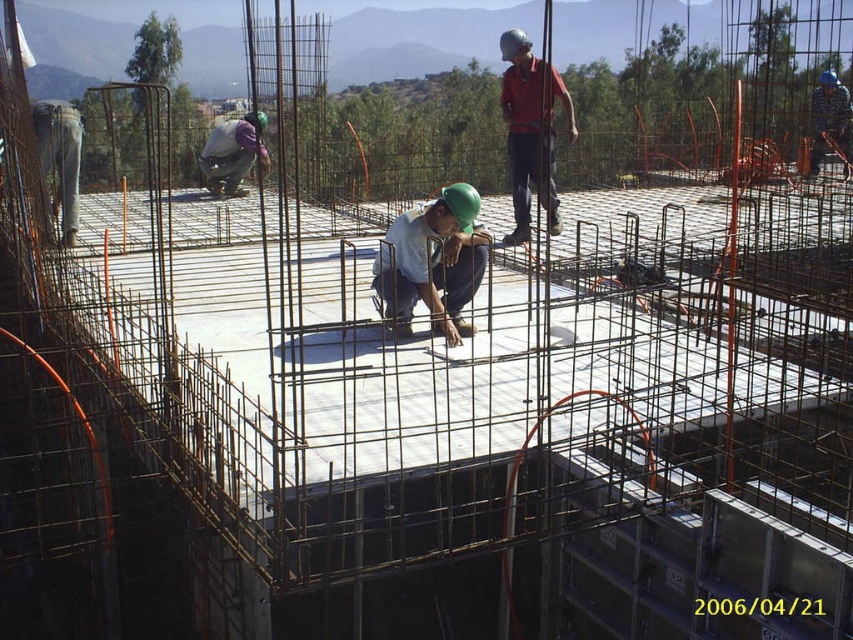
You are a construction supervisor checking the layout of the rebar cages. You notice a point at coordinates [432,262] on your blueprint. Where is this point located in relation to the workers?

A: The point at coordinates [432,262] corresponds to the green hard hat at center, so it is located where the worker in the green hard hat is standing.

You are a safety inspector reviewing the construction site. You notice the green hard hat at center and the red matte shirt at upper center in the image. Which object is positioned higher from the ground?

The red matte shirt at upper center is higher from the ground than the green hard hat at center because the red matte shirt at upper center is taller than the green hard hat at center.

You are a safety inspector standing at the red matte shirt at upper center. You need to check the safety equipment of the gray fabric worker at center. Can you safely walk towards them without crossing any hazardous areas? The construction site has a restricted zone that starts 6 meters away from the rebar cages.

The red matte shirt at upper center is 5.59 meters from the gray fabric worker at center. Since the restricted zone starts at 6 meters, the distance between them is within the safe limit. Therefore, you can walk towards the gray fabric worker at center without entering the hazardous area.